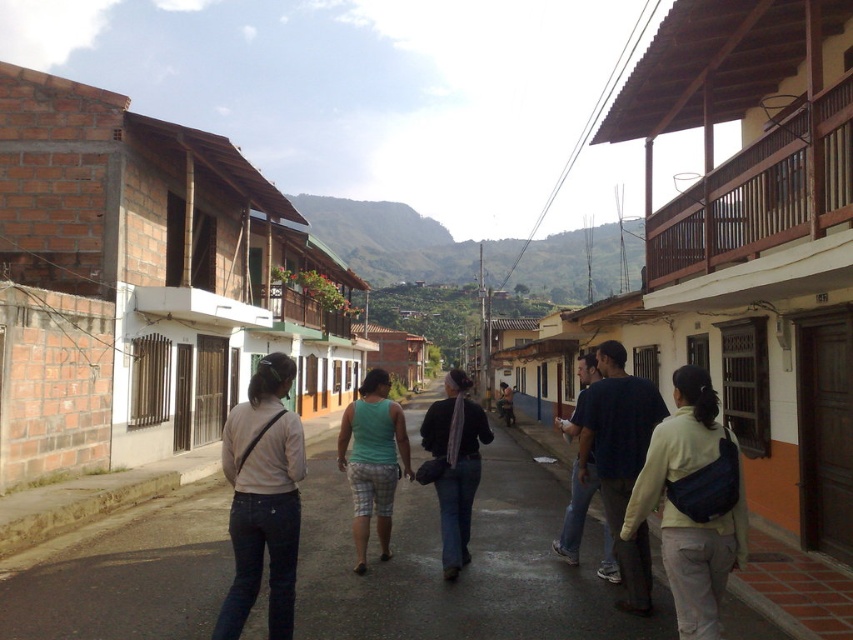
Is light yellow fabric jacket at lower right taller than dark blue jeans at center?

Incorrect, light yellow fabric jacket at lower right's height is not larger of dark blue jeans at center's.

Between point (642, 504) and point (457, 442), which one is positioned in front?

Point (642, 504) is more forward.

Between point (651, 440) and point (427, 413), which one is positioned behind?

The point (427, 413) is more distant.

Find the location of `light yellow fabric jacket at lower right`. light yellow fabric jacket at lower right is located at coordinates (693, 502).

Does light yellow fabric jacket at lower right lie in front of blue jeans at center?

Yes, it is.

This screenshot has height=640, width=853. Describe the element at coordinates (693, 502) in the screenshot. I see `light yellow fabric jacket at lower right` at that location.

I want to click on light yellow fabric jacket at lower right, so click(693, 502).

Is light yellow fabric jacket at lower right taller than dark blue shirt at center?

No.

Does light yellow fabric jacket at lower right have a greater width compared to dark blue shirt at center?

No, light yellow fabric jacket at lower right is not wider than dark blue shirt at center.

Identify the location of light yellow fabric jacket at lower right. Image resolution: width=853 pixels, height=640 pixels. (693, 502).

You are a GUI agent. You are given a task and a screenshot of the screen. Output one action in this format:
    pyautogui.click(x=<x>, y=<y>)
    Task: Click on the light yellow fabric jacket at lower right
    The height and width of the screenshot is (640, 853).
    Given the screenshot: What is the action you would take?
    pyautogui.click(x=693, y=502)